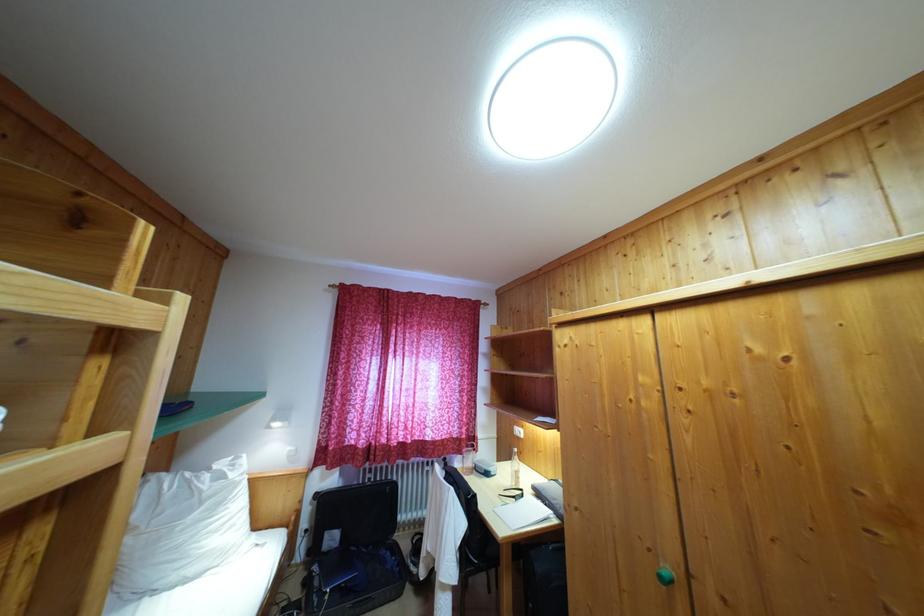
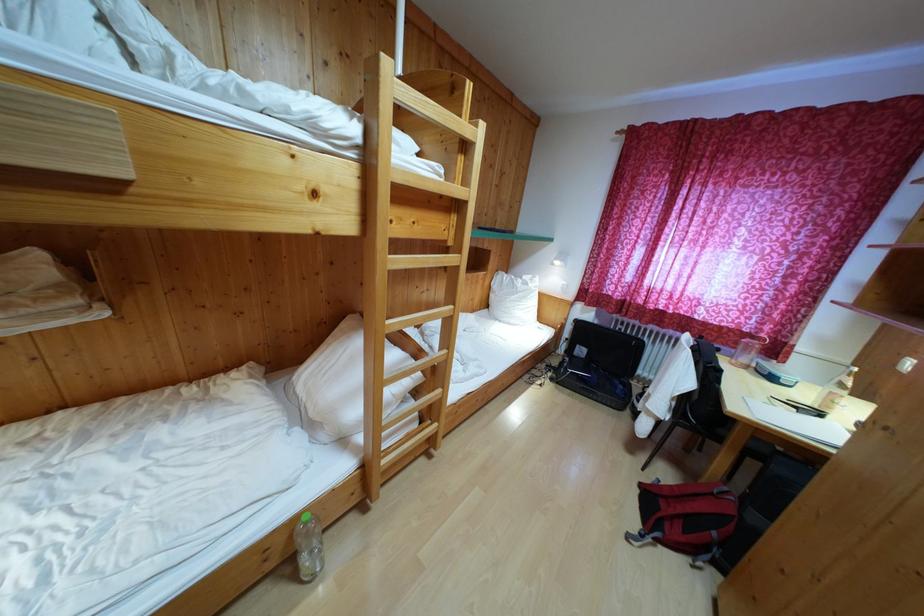
First-person continuous shooting, in which direction is the camera rotating?

The camera rotated toward left-down.